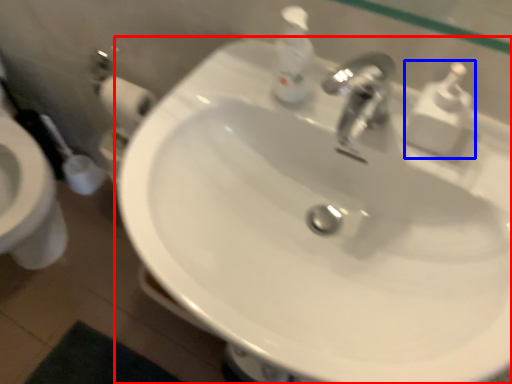
Question: Which object is closer to the camera taking this photo, sink (highlighted by a red box) or soap dispenser (highlighted by a blue box)?

Choices:
 (A) sink
 (B) soap dispenser

Answer: (A)